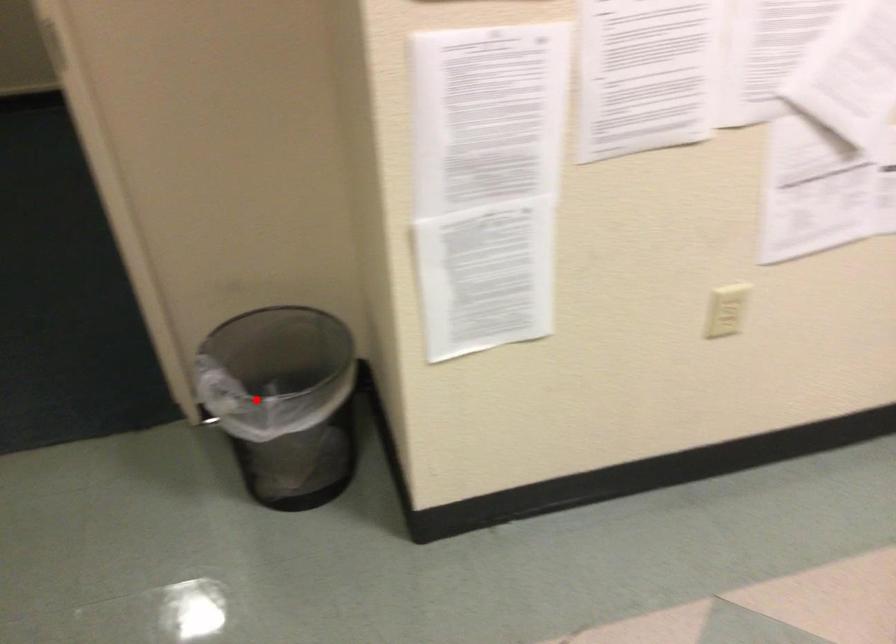
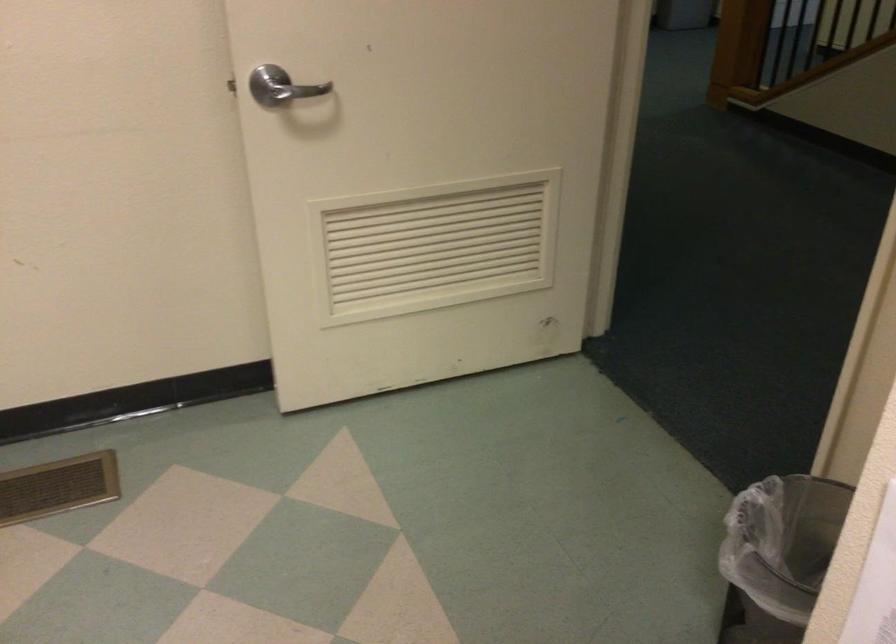
The point at the highlighted location is marked in the first image. Where is the corresponding point in the second image?

(778, 556)